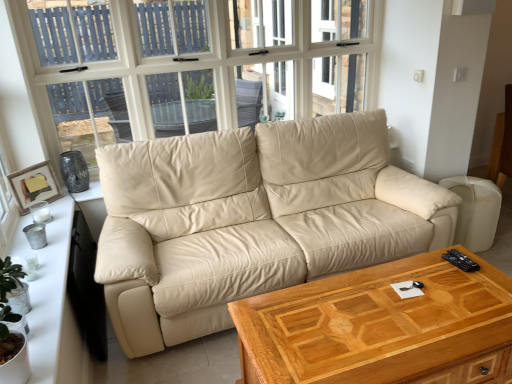
Question: Should I look upward or downward to see beige leather couch at center?

Choices:
 (A) up
 (B) down

Answer: (B)

Question: Is the depth of wooden coffee table at center greater than that of white glass window at upper center?

Choices:
 (A) yes
 (B) no

Answer: (B)

Question: From the image's perspective, is wooden coffee table at center over white glass window at upper center?

Choices:
 (A) yes
 (B) no

Answer: (B)

Question: Does wooden coffee table at center have a larger size compared to white glass window at upper center?

Choices:
 (A) no
 (B) yes

Answer: (A)

Question: From a real-world perspective, is wooden coffee table at center over white glass window at upper center?

Choices:
 (A) yes
 (B) no

Answer: (B)

Question: Is wooden coffee table at center smaller than white glass window at upper center?

Choices:
 (A) yes
 (B) no

Answer: (A)

Question: Is wooden coffee table at center surrounding white glass window at upper center?

Choices:
 (A) yes
 (B) no

Answer: (B)

Question: Is white glass window at upper center thinner than white wood dresser at left?

Choices:
 (A) no
 (B) yes

Answer: (B)

Question: From a real-world perspective, is white glass window at upper center positioned under white wood dresser at left based on gravity?

Choices:
 (A) yes
 (B) no

Answer: (B)

Question: Can you confirm if white glass window at upper center is wider than white wood dresser at left?

Choices:
 (A) no
 (B) yes

Answer: (A)

Question: From a real-world perspective, is white glass window at upper center located higher than white wood dresser at left?

Choices:
 (A) no
 (B) yes

Answer: (B)

Question: Is white glass window at upper center outside white wood dresser at left?

Choices:
 (A) yes
 (B) no

Answer: (A)

Question: Is white glass window at upper center aimed at white wood dresser at left?

Choices:
 (A) no
 (B) yes

Answer: (B)

Question: Does wooden framed picture at left have a greater width compared to white glass window at upper center?

Choices:
 (A) no
 (B) yes

Answer: (A)